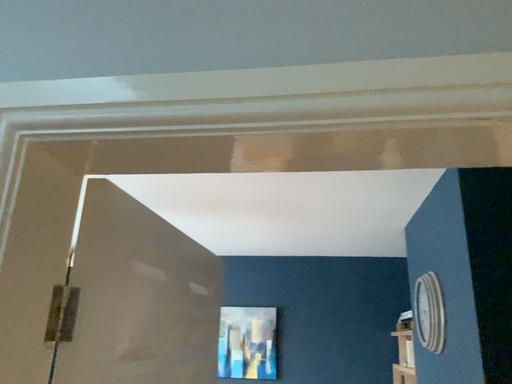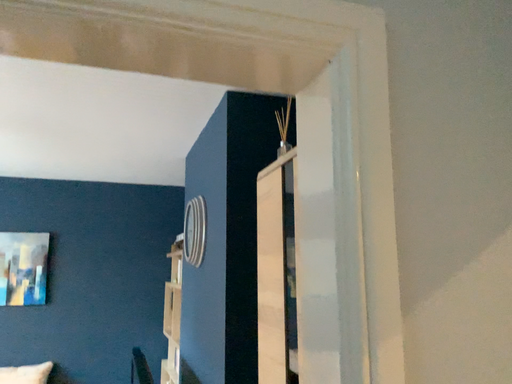
Question: Which way did the camera rotate in the video?

Choices:
 (A) rotated left
 (B) rotated right

Answer: (B)